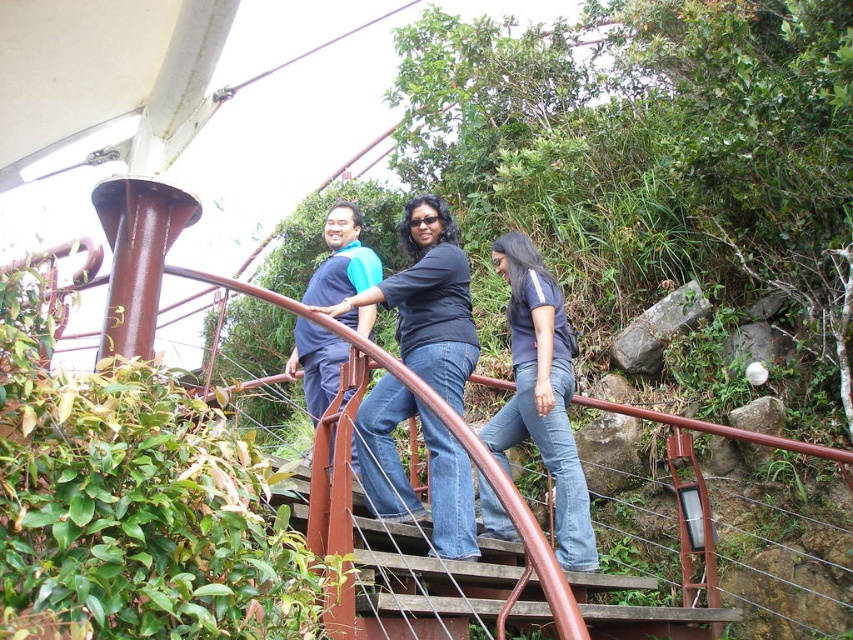
Question: Is dark blue jeans at center behind blue fabric shirt at center?

Choices:
 (A) no
 (B) yes

Answer: (A)

Question: Is dark blue jeans at center above dark blue shirt at center?

Choices:
 (A) yes
 (B) no

Answer: (A)

Question: Among these objects, which one is farthest from the camera?

Choices:
 (A) blue fabric shirt at center
 (B) dark blue jeans at center
 (C) dark blue shirt at center

Answer: (A)

Question: Which object is closer to the camera taking this photo?

Choices:
 (A) dark blue jeans at center
 (B) dark blue shirt at center
 (C) blue fabric shirt at center

Answer: (A)

Question: Which point is farther from the camera taking this photo?

Choices:
 (A) (366, 284)
 (B) (576, 465)
 (C) (419, 200)

Answer: (A)

Question: Is dark blue jeans at center positioned behind dark blue shirt at center?

Choices:
 (A) no
 (B) yes

Answer: (A)